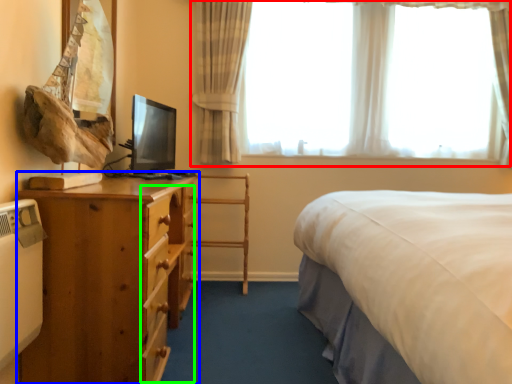
Question: Which is farther away from window (highlighted by a red box)? nightstand (highlighted by a blue box) or drawer (highlighted by a green box)?

Choices:
 (A) nightstand
 (B) drawer

Answer: (A)